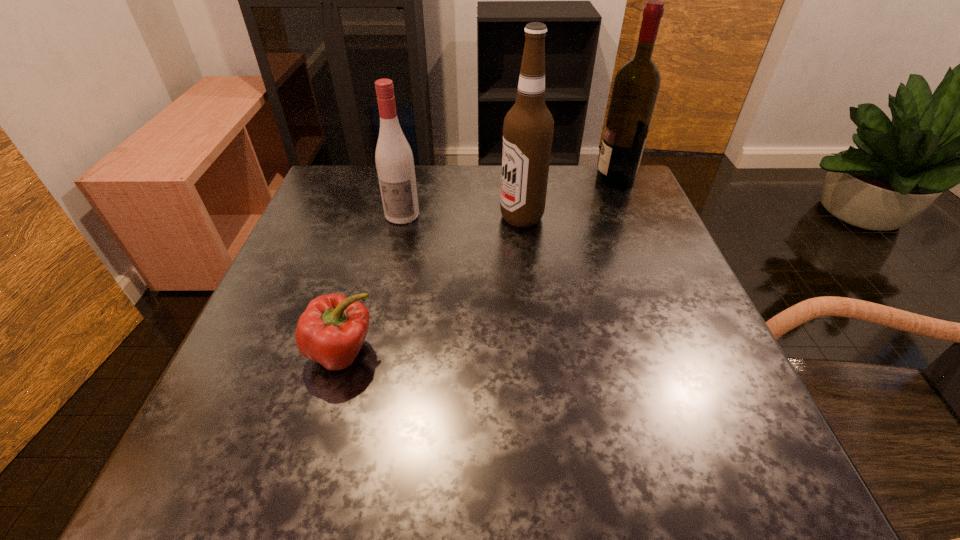
Find the location of a particular element. The image size is (960, 540). the second alcohol from right to left is located at coordinates (528, 128).

Find the location of a particular element. This screenshot has height=540, width=960. the rightmost object is located at coordinates (636, 86).

In order to click on the farthest object in this screenshot , I will do `click(636, 86)`.

Where is `the shortest alcohol`? the shortest alcohol is located at coordinates (394, 160).

This screenshot has width=960, height=540. In order to click on the leftmost alcohol in this screenshot , I will do `click(394, 160)`.

Where is `bell pepper`? Image resolution: width=960 pixels, height=540 pixels. bell pepper is located at coordinates (331, 331).

Find the location of `the shortest object`. the shortest object is located at coordinates (331, 331).

Where is `free space located on the label of the second alcohol from right to left`? Image resolution: width=960 pixels, height=540 pixels. free space located on the label of the second alcohol from right to left is located at coordinates 376,217.

The width and height of the screenshot is (960, 540). I want to click on vacant space positioned on the label of the second alcohol from right to left, so click(x=410, y=217).

This screenshot has width=960, height=540. What are the coordinates of `free spot located on the label of the second alcohol from right to left` in the screenshot? It's located at (347, 217).